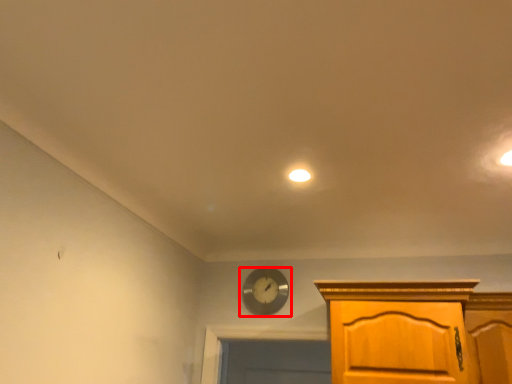
Question: In this image, where is wall clock (annotated by the red box) located relative to lighting?

Choices:
 (A) right
 (B) left

Answer: (B)